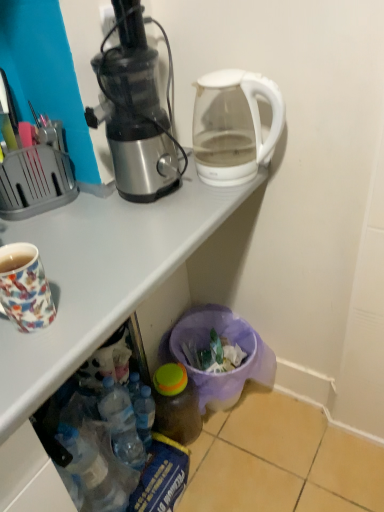
Find the location of a particular element. free space behind multicolored ceramic mug at left is located at coordinates (79, 256).